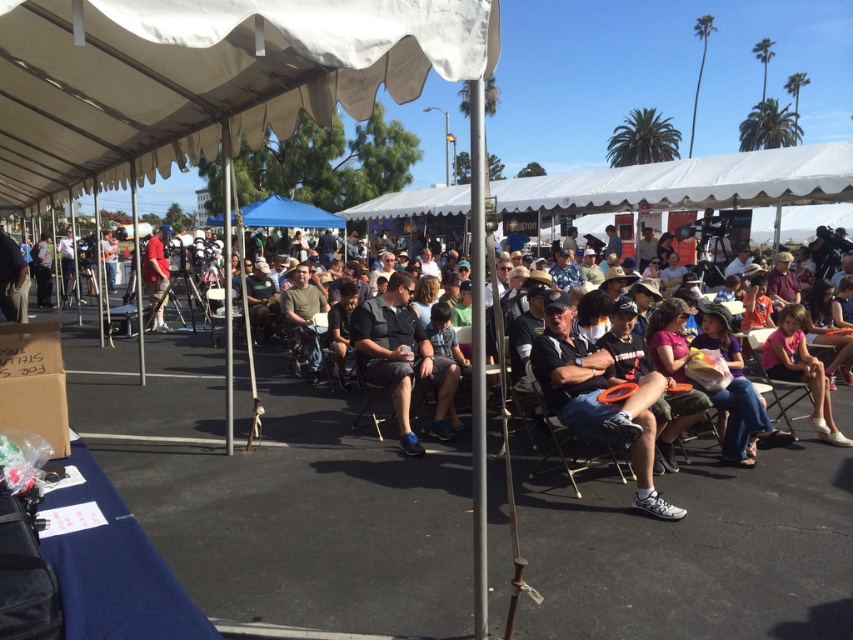
Question: Does dark gray fabric shirt at center have a lesser width compared to pink fabric dress at center?

Choices:
 (A) yes
 (B) no

Answer: (B)

Question: Does blue fabric canopy at upper center have a smaller size compared to matte red shirt at center?

Choices:
 (A) no
 (B) yes

Answer: (A)

Question: Estimate the real-world distances between objects in this image. Which object is farther from the dark gray fabric shirt at center?

Choices:
 (A) silver metallic pole at center
 (B) white fabric canopy at upper left
 (C) matte red shirt at center

Answer: (C)

Question: Is white fabric canopy at upper left wider than silver metallic pole at center?

Choices:
 (A) yes
 (B) no

Answer: (A)

Question: Which point is closer to the camera?

Choices:
 (A) (9, 32)
 (B) (474, 627)

Answer: (B)

Question: Which point is farther to the camera?

Choices:
 (A) click(144, 248)
 (B) click(483, 561)

Answer: (A)